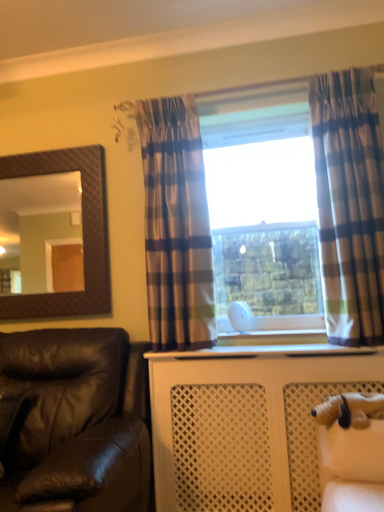
Question: Considering the relative sizes of brown textured mirror at upper left and plaid fabric curtain at right, arranged as the 1th curtain when viewed from the right, in the image provided, is brown textured mirror at upper left bigger than plaid fabric curtain at right, arranged as the 1th curtain when viewed from the right,?

Choices:
 (A) yes
 (B) no

Answer: (B)

Question: Is brown textured mirror at upper left smaller than plaid fabric curtain at right, arranged as the 1th curtain when viewed from the right?

Choices:
 (A) yes
 (B) no

Answer: (A)

Question: Is brown textured mirror at upper left next to plaid fabric curtain at right, marked as the second curtain in a left-to-right arrangement?

Choices:
 (A) yes
 (B) no

Answer: (B)

Question: Is brown textured mirror at upper left aimed at plaid fabric curtain at right, arranged as the 1th curtain when viewed from the right?

Choices:
 (A) yes
 (B) no

Answer: (B)

Question: Is brown textured mirror at upper left at the left side of plaid fabric curtain at right, marked as the second curtain in a left-to-right arrangement?

Choices:
 (A) no
 (B) yes

Answer: (B)

Question: Is point (119, 455) positioned closer to the camera than point (160, 343)?

Choices:
 (A) closer
 (B) farther

Answer: (A)

Question: Considering the relative positions of leather at left and plaid fabric curtain at center, marked as the 1th curtain in a left-to-right arrangement, in the image provided, is leather at left to the left or to the right of plaid fabric curtain at center, marked as the 1th curtain in a left-to-right arrangement,?

Choices:
 (A) right
 (B) left

Answer: (B)

Question: From their relative heights in the image, would you say leather at left is taller or shorter than plaid fabric curtain at center, marked as the second curtain in a right-to-left arrangement?

Choices:
 (A) tall
 (B) short

Answer: (B)

Question: From the image's perspective, is leather at left above or below plaid fabric curtain at center, marked as the second curtain in a right-to-left arrangement?

Choices:
 (A) above
 (B) below

Answer: (B)

Question: Is point (336, 291) closer or farther from the camera than point (345, 404)?

Choices:
 (A) closer
 (B) farther

Answer: (B)

Question: From a real-world perspective, relative to white plush dog at lower right, is plaid fabric curtain at right, arranged as the 1th curtain when viewed from the right, vertically above or below?

Choices:
 (A) above
 (B) below

Answer: (A)

Question: Looking at the image, does plaid fabric curtain at right, arranged as the 1th curtain when viewed from the right, seem bigger or smaller compared to white plush dog at lower right?

Choices:
 (A) big
 (B) small

Answer: (A)

Question: From the image's perspective, is plaid fabric curtain at right, arranged as the 1th curtain when viewed from the right, above or below white plush dog at lower right?

Choices:
 (A) above
 (B) below

Answer: (A)

Question: From the image's perspective, relative to white plastic window frame at center, is brown textured mirror at upper left above or below?

Choices:
 (A) below
 (B) above

Answer: (A)

Question: Is brown textured mirror at upper left wider or thinner than white plastic window frame at center?

Choices:
 (A) wide
 (B) thin

Answer: (B)